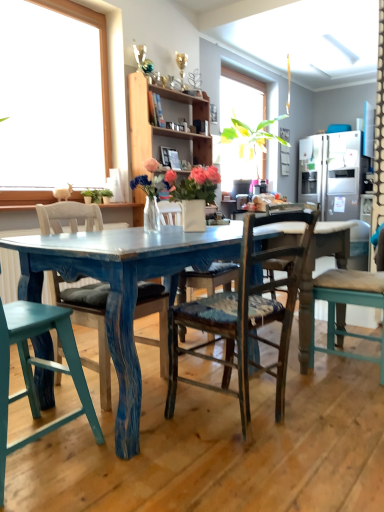
Question: Does wooden shelf at upper center come in front of satin silver refrigerator at right?

Choices:
 (A) yes
 (B) no

Answer: (A)

Question: Is the position of wooden shelf at upper center more distant than that of satin silver refrigerator at right?

Choices:
 (A) yes
 (B) no

Answer: (B)

Question: Considering the relative sizes of wooden shelf at upper center and satin silver refrigerator at right in the image provided, is wooden shelf at upper center bigger than satin silver refrigerator at right?

Choices:
 (A) no
 (B) yes

Answer: (A)

Question: Are wooden shelf at upper center and satin silver refrigerator at right far apart?

Choices:
 (A) yes
 (B) no

Answer: (A)

Question: Is wooden shelf at upper center to the right of satin silver refrigerator at right from the viewer's perspective?

Choices:
 (A) no
 (B) yes

Answer: (A)

Question: Can we say wooden shelf at upper center lies outside satin silver refrigerator at right?

Choices:
 (A) yes
 (B) no

Answer: (A)

Question: Does worn wood chair at center, placed as the second chair when sorted from right to left, appear on the right side of wooden shelf at upper center?

Choices:
 (A) yes
 (B) no

Answer: (A)

Question: From the image's perspective, is worn wood chair at center, which is counted as the third chair, starting from the left, over wooden shelf at upper center?

Choices:
 (A) yes
 (B) no

Answer: (B)

Question: Is worn wood chair at center, which is counted as the third chair, starting from the left, directly adjacent to wooden shelf at upper center?

Choices:
 (A) no
 (B) yes

Answer: (A)

Question: From the image's perspective, is worn wood chair at center, placed as the second chair when sorted from right to left, below wooden shelf at upper center?

Choices:
 (A) yes
 (B) no

Answer: (A)

Question: Is worn wood chair at center, which is counted as the third chair, starting from the left, bigger than wooden shelf at upper center?

Choices:
 (A) no
 (B) yes

Answer: (A)

Question: Can we say worn wood chair at center, placed as the second chair when sorted from right to left, lies outside wooden shelf at upper center?

Choices:
 (A) no
 (B) yes

Answer: (B)

Question: From a real-world perspective, is distressed teal chair at center, placed as the 3th chair when sorted from right to left, under wooden chair with cushion at right, acting as the fourth chair starting from the left?

Choices:
 (A) yes
 (B) no

Answer: (A)